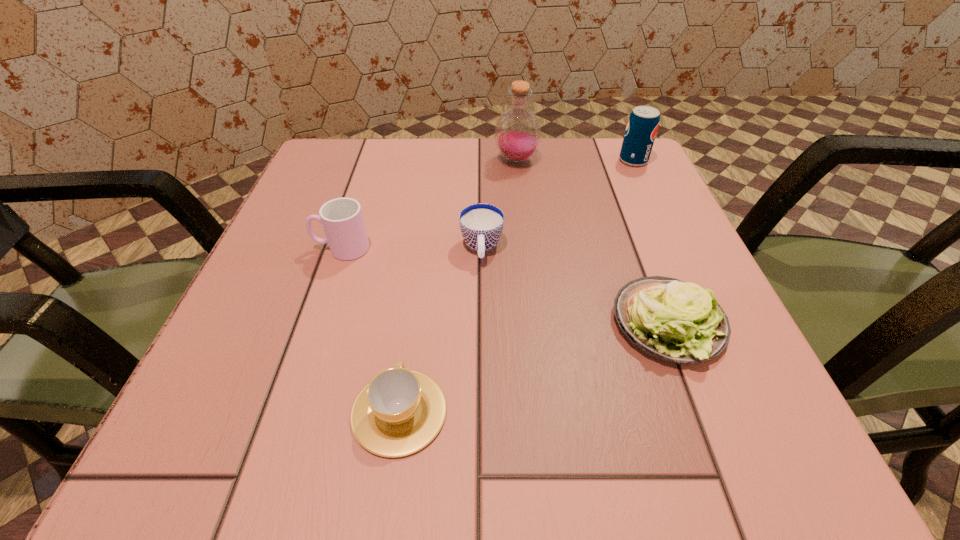
Locate an element on the screen. Image resolution: width=960 pixels, height=540 pixels. object that can be found as the fifth closest to the lettuce is located at coordinates point(342,219).

Choose which cup is the second nearest neighbor to the second tallest object. Please provide its 2D coordinates. Your answer should be formatted as a tuple, i.e. [(x, y)], where the tuple contains the x and y coordinates of a point satisfying the conditions above.

[(342, 219)]

Select which cup appears as the second closest to the second cup from left to right. Please provide its 2D coordinates. Your answer should be formatted as a tuple, i.e. [(x, y)], where the tuple contains the x and y coordinates of a point satisfying the conditions above.

[(342, 219)]

This screenshot has width=960, height=540. What are the coordinates of `free space that satisfies the following two spatial constraints: 1. with the handle on the side of the lettuce; 2. on the left side of the second object from left to right` in the screenshot? It's located at (412, 323).

Identify the location of free space that satisfies the following two spatial constraints: 1. with the handle on the side of the second cup from right to left; 2. on the left side of the bottle. (435, 160).

Image resolution: width=960 pixels, height=540 pixels. What are the coordinates of `vacant point that satisfies the following two spatial constraints: 1. with the handle on the side of the nearest cup; 2. on the left side of the tallest object` in the screenshot? It's located at 435,160.

The height and width of the screenshot is (540, 960). In order to click on free point that satisfies the following two spatial constraints: 1. with the handle on the side of the leftmost object; 2. on the left side of the pop in this screenshot , I will do `click(371, 160)`.

Find the location of a particular element. The width and height of the screenshot is (960, 540). vacant space that satisfies the following two spatial constraints: 1. with the handle on the side of the nearest cup; 2. on the right side of the lettuce is located at coordinates (412, 323).

The width and height of the screenshot is (960, 540). I want to click on vacant region that satisfies the following two spatial constraints: 1. with the handle on the side of the bottle; 2. on the left side of the leftmost cup, so click(x=371, y=160).